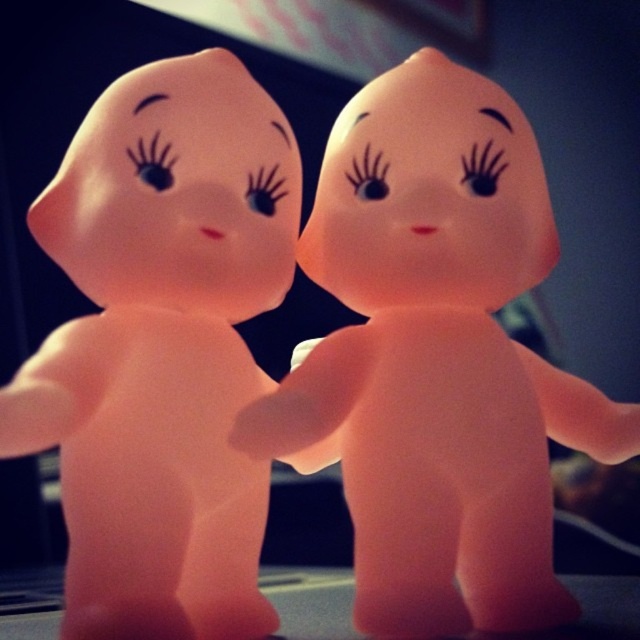
You are a toy organizer who needs to place both the pink rubber doll at center and the pink rubber figurine at center into a storage box that is 15 centimeters wide. Can both fit side by side without overlapping?

The distance between the pink rubber doll at center and the pink rubber figurine at center is 15.54 centimeters, which is wider than the 15 cm storage box. Therefore, they cannot fit side by side without overlapping in the box.